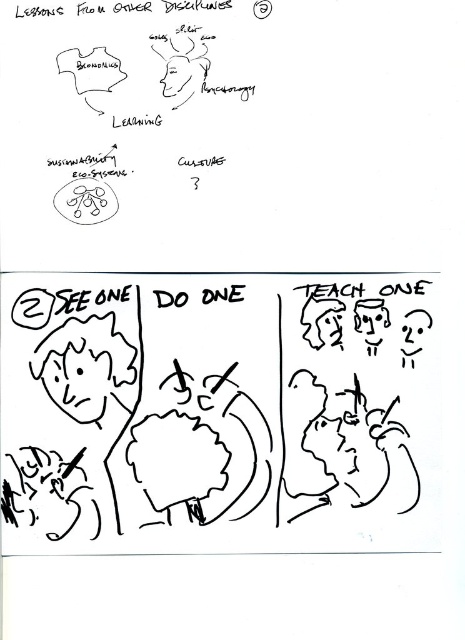
You are an artist holding a black ink pen at lower left and looking at a smooth skin face at center in your drawing. Can you tell me which object is physically larger in the image?

The black ink pen at lower left is bigger than the smooth skin face at center in the image.

You are standing at point A located at point (26,460) and need to reach point B which is 37.56 inches away. Considering the scale of the drawing, can you estimate how many steps it would take if each step covers 2.5 feet?

The distance between the points is 37.56 inches. Since each step covers 2.5 feet, which is 30 inches, dividing 37.56 by 30 gives approximately 1.25 steps. Therefore, it would take about 2 steps to cover the distance.